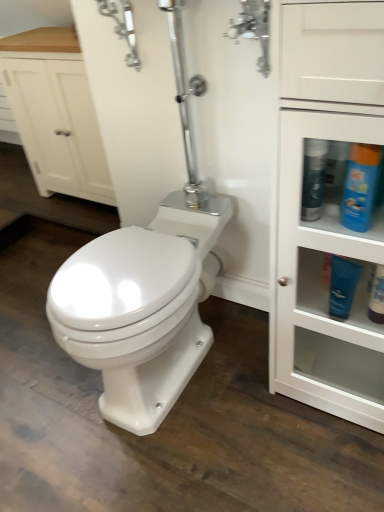
Question: From the image's perspective, is blue glossy bottle at upper right, placed as the 2th cleaning product when sorted from left to right, positioned above or below blue matte lotion at right, the second toiletry in the right-to-left sequence?

Choices:
 (A) below
 (B) above

Answer: (B)

Question: Considering the positions of blue glossy bottle at upper right, which is the 1th cleaning product from right to left, and blue matte lotion at right, which is counted as the 1th toiletry, starting from the left, in the image, is blue glossy bottle at upper right, which is the 1th cleaning product from right to left, bigger or smaller than blue matte lotion at right, which is counted as the 1th toiletry, starting from the left,?

Choices:
 (A) small
 (B) big

Answer: (B)

Question: Based on their relative distances, which object is nearer to the blue glossy bottle at upper right, which is the 1th cleaning product from right to left?

Choices:
 (A) blue matte lotion at right, the second toiletry in the right-to-left sequence
 (B) blue glossy bottle at upper right, acting as the second cleaning product starting from the right
 (C) polished chrome faucet at upper center
 (D) white glossy cabinet at right
 (E) matte white lotion at lower right, marked as the first toiletry in a right-to-left arrangement

Answer: (B)

Question: Which of these objects is positioned closest to the blue glossy bottle at upper right, acting as the second cleaning product starting from the right?

Choices:
 (A) white wood cabinet at upper left
 (B) white glossy cabinet at right
 (C) matte white lotion at lower right, arranged as the second toiletry when viewed from the left
 (D) blue glossy bottle at upper right, placed as the 2th cleaning product when sorted from left to right
 (E) blue matte lotion at right, the second toiletry in the right-to-left sequence

Answer: (D)